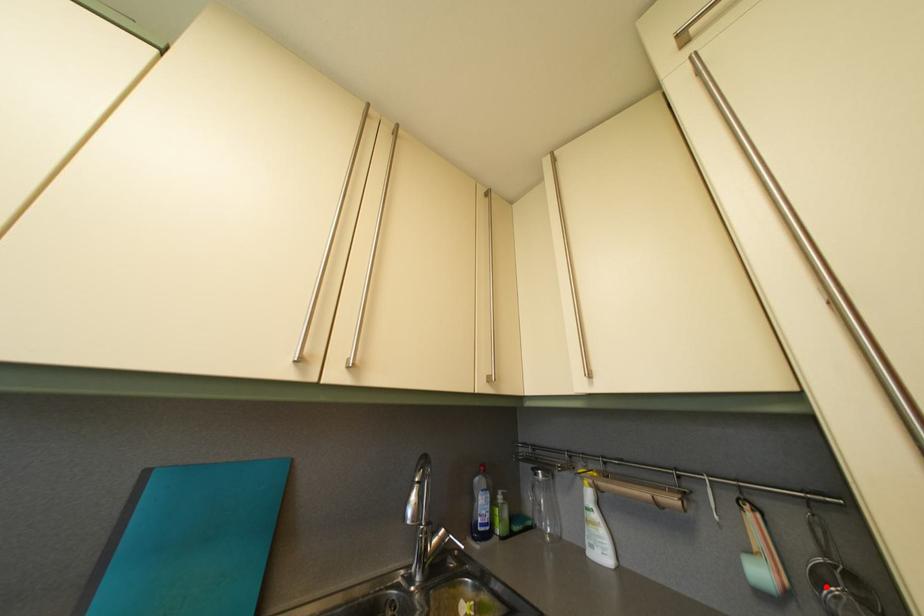
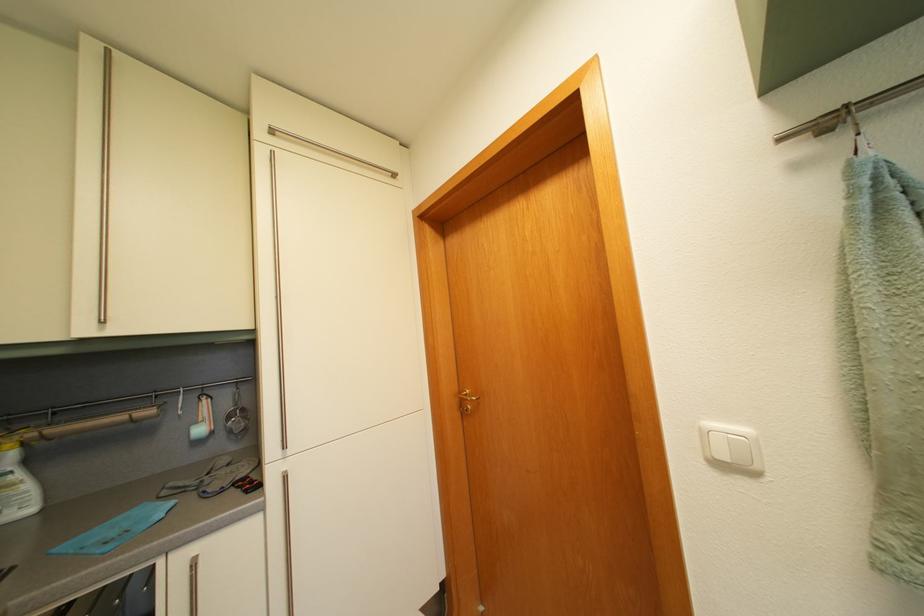
In the second image, find the point that corresponds to the highlighted location in the first image.

(237, 424)